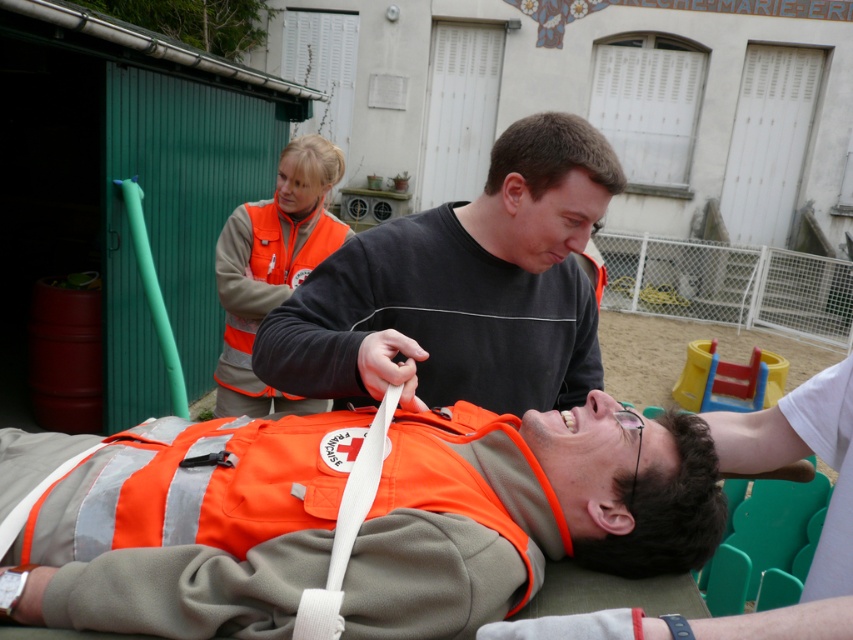
Is matte black shirt at center to the right of orange fabric vest at center from the viewer's perspective?

Incorrect, matte black shirt at center is not on the right side of orange fabric vest at center.

Which is more to the left, matte black shirt at center or orange fabric vest at center?

From the viewer's perspective, matte black shirt at center appears more on the left side.

Which is behind, point (567, 403) or point (828, 426)?

The point (567, 403) is behind.

At what (x,y) coordinates should I click in order to perform the action: click on matte black shirt at center. Please return your answer as a coordinate pair (x, y). Looking at the image, I should click on (462, 289).